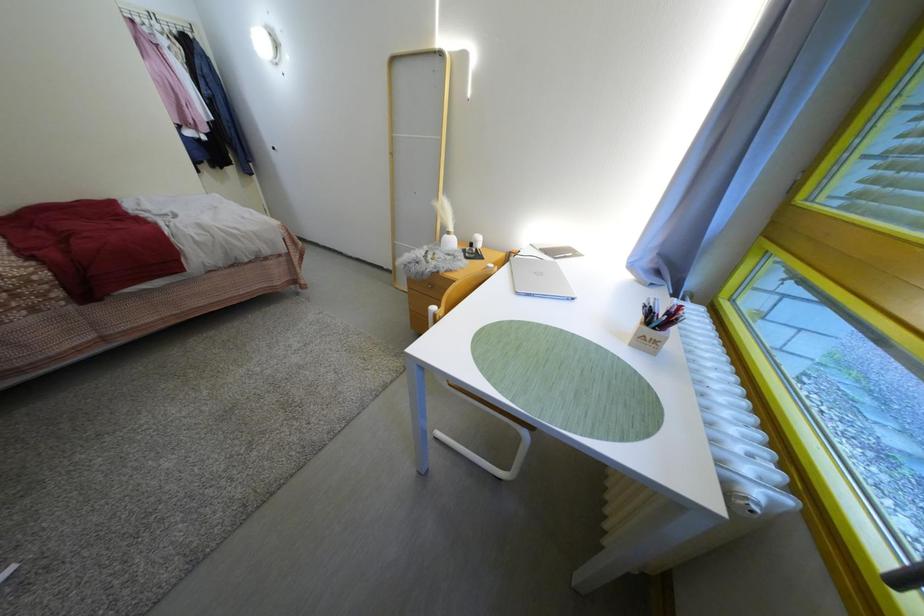
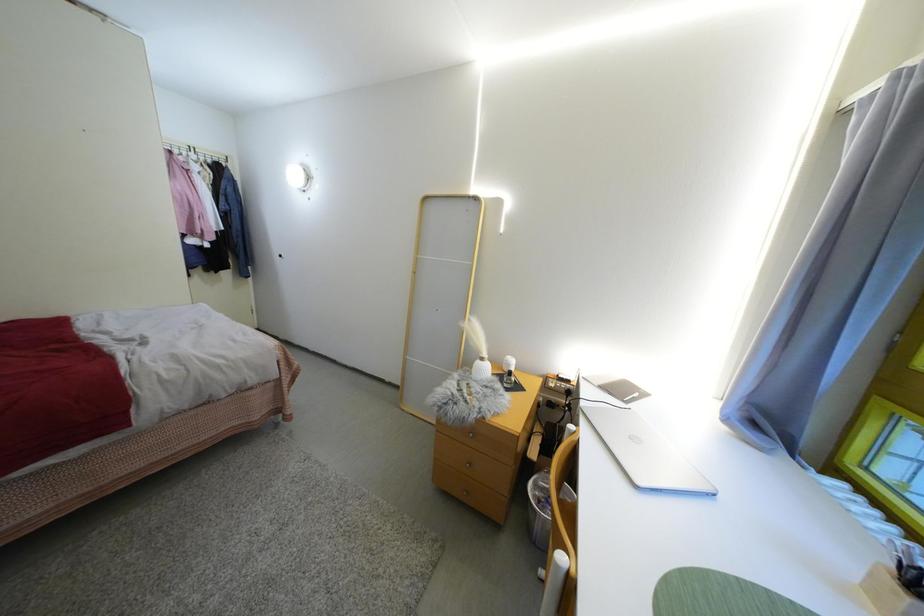
Question: Based on the continuous images, in which direction is the camera rotating? Reply with the corresponding letter.

Choices:
 (A) Left
 (B) Right
 (C) Up
 (D) Down

Answer: (C)